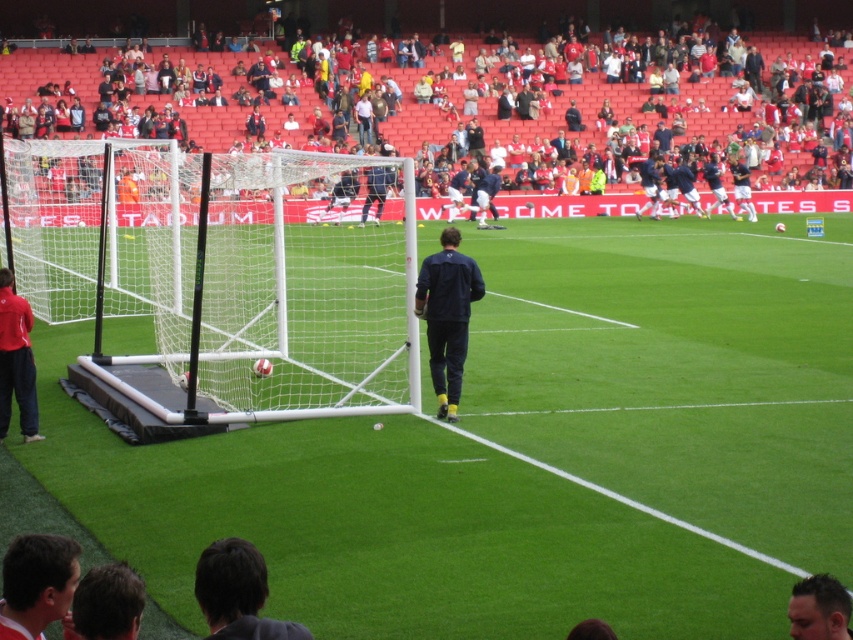
You are a soccer coach observing the training session. You notice the white plastic goal at lower left and the dark blue jersey at center. Which object is taller?

The white plastic goal at lower left is taller than the dark blue jersey at center.

You are a soccer coach observing the field. You need to place a cone on the shorter surface between the white synthetic turf at center and the red fabric seats at upper center. Which surface should you choose?

The white synthetic turf at center is shorter than the red fabric seats at upper center, so you should place the cone on the white synthetic turf at center.

You are a photographer standing at the edge of the soccer field. You want to take a photo of the white synthetic turf at center without the red fabric seats at upper center blocking the view. Is it possible to do so by adjusting your angle?

The white synthetic turf at center is positioned under the red fabric seats at upper center, so if you lower your camera angle or move to a lower position, you can capture the white synthetic turf at center without the seats blocking the view.